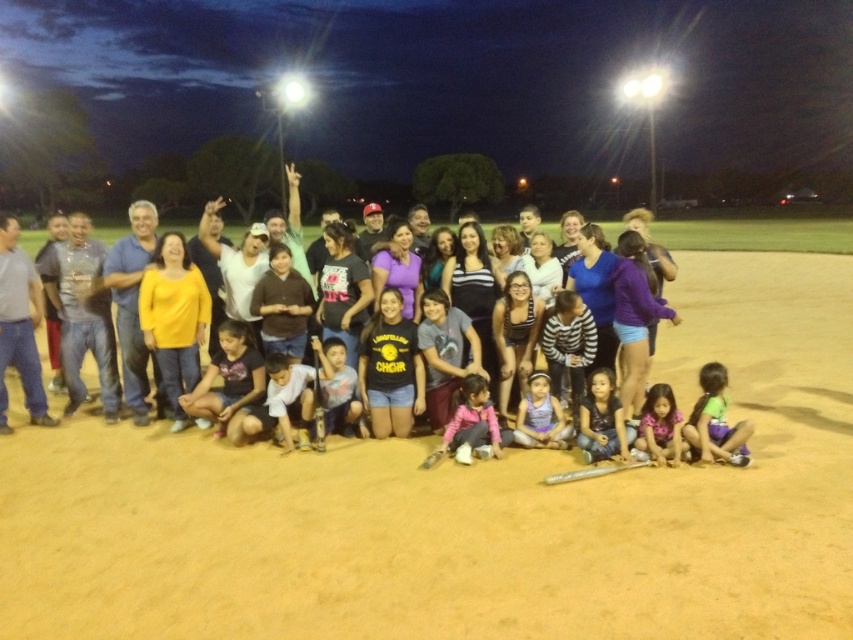
You are a photographer trying to capture a clear shot of both the pink fleece jacket at center and the pink floral dress at lower right. Which one will appear larger in the photo?

The pink fleece jacket at center will appear larger in the photo because it is closer to the camera than the pink floral dress at lower right.

Consider the image. You are a photographer trying to capture a photo of the group. You notice the green fabric pants at lower right and the matte blue jeans at lower center. Which pair of pants will appear taller in the photo?

The green fabric pants at lower right will appear taller in the photo because it is taller than the matte blue jeans at lower center according to the description.

From the picture: You are standing at the point with coordinates point (601,438) and want to walk towards the point with coordinates point (714,449). Which direction should you move in to get closer to the destination?

Since point (714,449) is closer to the viewer than point (601,438), you should move forward towards the direction of the destination point to get closer.